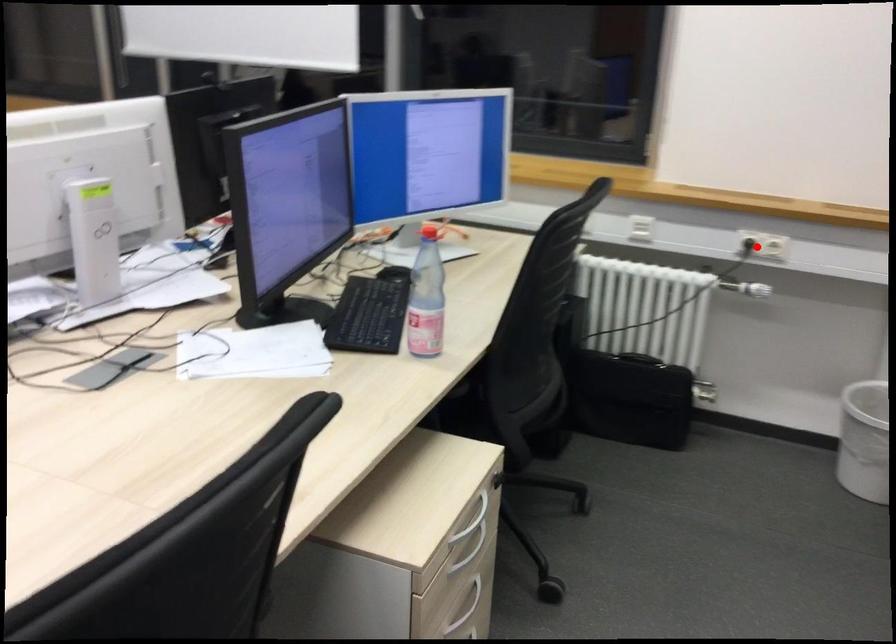
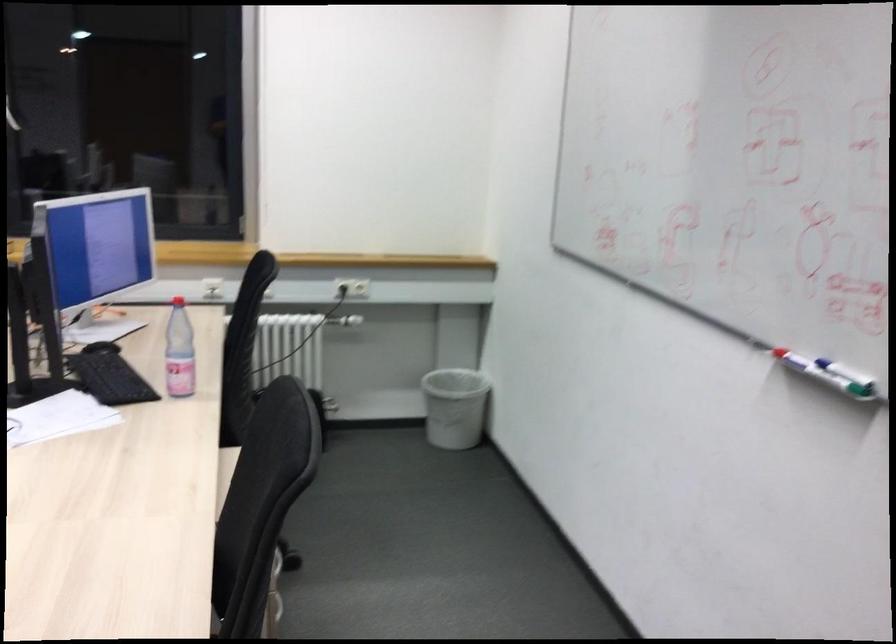
Question: I am providing you with two images of the same scene from different viewpoints. Given a red point in image1, look at the same physical point in image2. Is it:

Choices:
 (A) Closer to the viewpoint
 (B) Farther from the viewpoint

Answer: (B)